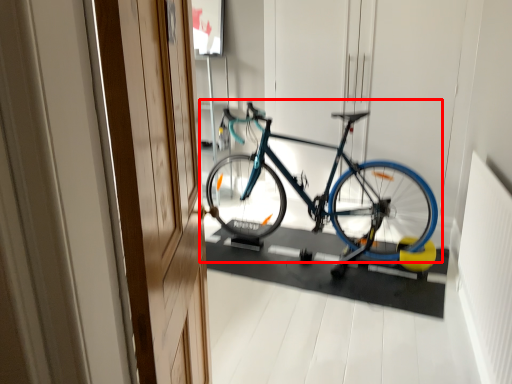
Question: From the image's perspective, where is bicycle (annotated by the red box) located relative to door?

Choices:
 (A) above
 (B) below

Answer: (A)